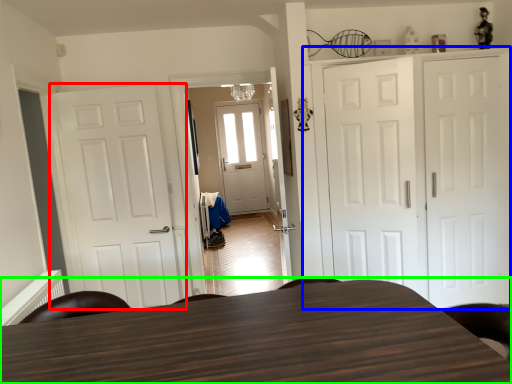
Question: Which object is the farthest from door (highlighted by a red box)? Choose among these: cabinetry (highlighted by a blue box) or table (highlighted by a green box).

Choices:
 (A) cabinetry
 (B) table

Answer: (B)